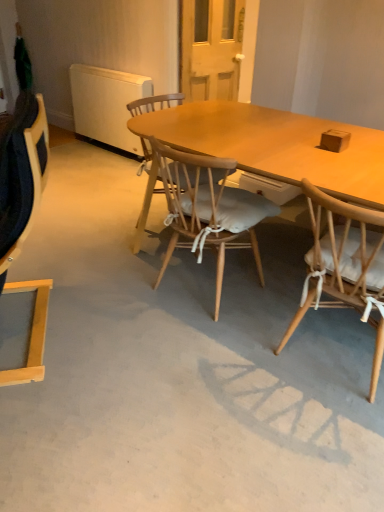
In order to click on vacant area located to the right-hand side of wooden chair with cushion at center, acting as the second chair starting from the right in this screenshot , I will do `click(277, 285)`.